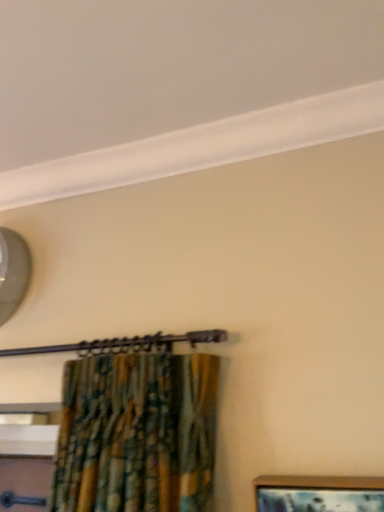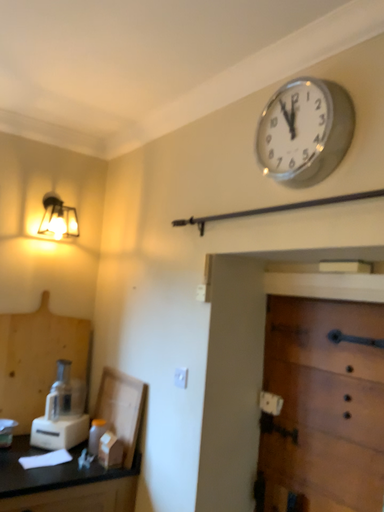
Question: How did the camera likely rotate when shooting the video?

Choices:
 (A) rotated left
 (B) rotated right

Answer: (A)